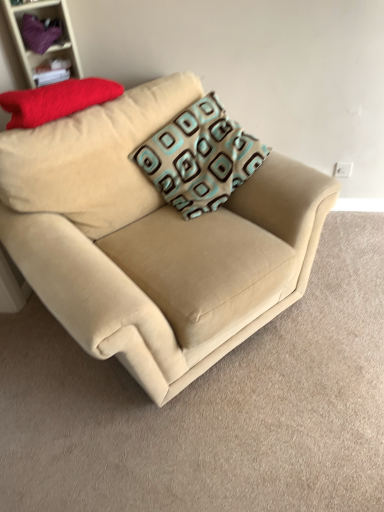
Looking at this image, measure the distance between purple fabric at upper left and camera.

A distance of 5.94 feet exists between purple fabric at upper left and camera.

Image resolution: width=384 pixels, height=512 pixels. Identify the location of beige fabric couch at center. (153, 237).

At what (x,y) coordinates should I click in order to perform the action: click on teal-patterned cushion at center, which is the first pillow from right to left. Please return your answer as a coordinate pair (x, y). The image size is (384, 512). Looking at the image, I should click on (199, 158).

Identify the location of matte red pillow at upper left, acting as the 2th pillow starting from the right. The height and width of the screenshot is (512, 384). (56, 100).

Identify the location of purple fabric at upper left. This screenshot has width=384, height=512. (40, 33).

Based on the photo, can you confirm if matte red pillow at upper left, which appears as the 1th pillow when viewed from the left, is positioned to the left of matte purple fabric at upper left?

Incorrect, matte red pillow at upper left, which appears as the 1th pillow when viewed from the left, is not on the left side of matte purple fabric at upper left.

From the picture: Which of these two, matte red pillow at upper left, acting as the 2th pillow starting from the right, or matte purple fabric at upper left, stands taller?

matte purple fabric at upper left.

Would you consider matte red pillow at upper left, which appears as the 1th pillow when viewed from the left, to be distant from matte purple fabric at upper left?

That's not correct — matte red pillow at upper left, which appears as the 1th pillow when viewed from the left, is a little close to matte purple fabric at upper left.

Could you tell me if matte red pillow at upper left, which appears as the 1th pillow when viewed from the left, is facing matte purple fabric at upper left?

No, matte red pillow at upper left, which appears as the 1th pillow when viewed from the left, does not turn towards matte purple fabric at upper left.

What's the angular difference between beige fabric couch at center and teal-patterned cushion at center, the 2th pillow viewed from the left,'s facing directions?

beige fabric couch at center and teal-patterned cushion at center, the 2th pillow viewed from the left, are facing 6.04 degrees away from each other.

Which is closer to the camera, (256,278) or (250,169)?

The point (256,278) is closer to the camera.

In the scene shown: Could you tell me if beige fabric couch at center is facing teal-patterned cushion at center, which is the first pillow from right to left?

Yes, beige fabric couch at center is aimed at teal-patterned cushion at center, which is the first pillow from right to left.

Is beige fabric couch at center wider than teal-patterned cushion at center, the 2th pillow viewed from the left?

Yes.

Would you say beige fabric couch at center is part of matte red pillow at upper left, acting as the 2th pillow starting from the right,'s contents?

No, beige fabric couch at center is located outside of matte red pillow at upper left, acting as the 2th pillow starting from the right.

What's the angular difference between matte red pillow at upper left, acting as the 2th pillow starting from the right, and beige fabric couch at center's facing directions?

They differ by 4.75 degrees in their facing directions.

Could you measure the distance between matte red pillow at upper left, acting as the 2th pillow starting from the right, and beige fabric couch at center?

matte red pillow at upper left, acting as the 2th pillow starting from the right, is 50.48 centimeters away from beige fabric couch at center.

Considering the positions of objects matte red pillow at upper left, which appears as the 1th pillow when viewed from the left, and beige fabric couch at center in the image provided, who is in front, matte red pillow at upper left, which appears as the 1th pillow when viewed from the left, or beige fabric couch at center?

Positioned in front is beige fabric couch at center.

Between teal-patterned cushion at center, the 2th pillow viewed from the left, and matte red pillow at upper left, which appears as the 1th pillow when viewed from the left, which one has larger width?

Wider between the two is teal-patterned cushion at center, the 2th pillow viewed from the left.

Is point (225, 151) behind point (111, 93)?

That is True.

Can we say teal-patterned cushion at center, which is the first pillow from right to left, lies outside matte red pillow at upper left, acting as the 2th pillow starting from the right?

Yes, teal-patterned cushion at center, which is the first pillow from right to left, is located beyond the bounds of matte red pillow at upper left, acting as the 2th pillow starting from the right.

Considering the relative positions of teal-patterned cushion at center, which is the first pillow from right to left, and matte red pillow at upper left, which appears as the 1th pillow when viewed from the left, in the image provided, is teal-patterned cushion at center, which is the first pillow from right to left, to the left of matte red pillow at upper left, which appears as the 1th pillow when viewed from the left, from the viewer's perspective?

No, teal-patterned cushion at center, which is the first pillow from right to left, is not to the left of matte red pillow at upper left, which appears as the 1th pillow when viewed from the left.

Consider the image. Between matte purple fabric at upper left and purple fabric at upper left, which one has larger width?

Wider between the two is purple fabric at upper left.

Is the depth of matte purple fabric at upper left greater than that of purple fabric at upper left?

No.

Between matte purple fabric at upper left and purple fabric at upper left, which one has larger size?

Bigger between the two is matte purple fabric at upper left.

From a real-world perspective, is matte purple fabric at upper left located beneath purple fabric at upper left?

A: Yes, from a real-world perspective, matte purple fabric at upper left is under purple fabric at upper left.

Who is more distant, matte red pillow at upper left, which appears as the 1th pillow when viewed from the left, or purple fabric at upper left?

purple fabric at upper left.

Is matte red pillow at upper left, acting as the 2th pillow starting from the right, looking in the opposite direction of purple fabric at upper left?

No.

Considering the sizes of objects matte red pillow at upper left, which appears as the 1th pillow when viewed from the left, and purple fabric at upper left in the image provided, who is thinner, matte red pillow at upper left, which appears as the 1th pillow when viewed from the left, or purple fabric at upper left?

purple fabric at upper left.

Considering the relative sizes of matte red pillow at upper left, acting as the 2th pillow starting from the right, and purple fabric at upper left in the image provided, is matte red pillow at upper left, acting as the 2th pillow starting from the right, shorter than purple fabric at upper left?

In fact, matte red pillow at upper left, acting as the 2th pillow starting from the right, may be taller than purple fabric at upper left.

From a real-world perspective, is beige fabric couch at center positioned above or below matte purple fabric at upper left?

In terms of real-world spatial position, beige fabric couch at center is below matte purple fabric at upper left.

Looking at this image, is beige fabric couch at center further to camera compared to matte purple fabric at upper left?

That is False.

Is beige fabric couch at center positioned far away from matte purple fabric at upper left?

No.

How many degrees apart are the facing directions of beige fabric couch at center and matte purple fabric at upper left?

The angle between the facing direction of beige fabric couch at center and the facing direction of matte purple fabric at upper left is 10.2 degrees.

This screenshot has width=384, height=512. In order to click on pillow that is the 1st object located below the matte purple fabric at upper left (from the image's perspective) in this screenshot , I will do `click(56, 100)`.

I want to click on studio couch on the left of teal-patterned cushion at center, the 2th pillow viewed from the left, so click(x=153, y=237).

When comparing their distances from beige fabric couch at center, does matte red pillow at upper left, which appears as the 1th pillow when viewed from the left, or teal-patterned cushion at center, the 2th pillow viewed from the left, seem closer?

teal-patterned cushion at center, the 2th pillow viewed from the left.

Estimate the real-world distances between objects in this image. Which object is closer to matte purple fabric at upper left, teal-patterned cushion at center, which is the first pillow from right to left, or matte red pillow at upper left, acting as the 2th pillow starting from the right?

Among the two, matte red pillow at upper left, acting as the 2th pillow starting from the right, is located nearer to matte purple fabric at upper left.

From the picture: Which object lies nearer to the anchor point beige fabric couch at center, purple fabric at upper left or teal-patterned cushion at center, which is the first pillow from right to left?

teal-patterned cushion at center, which is the first pillow from right to left.

From the image, which object appears to be nearer to matte purple fabric at upper left, matte red pillow at upper left, acting as the 2th pillow starting from the right, or teal-patterned cushion at center, which is the first pillow from right to left?

matte red pillow at upper left, acting as the 2th pillow starting from the right.

When comparing their distances from teal-patterned cushion at center, the 2th pillow viewed from the left, does beige fabric couch at center or purple fabric at upper left seem further?

Among the two, purple fabric at upper left is located further to teal-patterned cushion at center, the 2th pillow viewed from the left.

Looking at this image, considering their positions, is matte red pillow at upper left, acting as the 2th pillow starting from the right, positioned further to purple fabric at upper left than matte purple fabric at upper left?

matte red pillow at upper left, acting as the 2th pillow starting from the right, is positioned further to the anchor purple fabric at upper left.

Considering their positions, is matte red pillow at upper left, which appears as the 1th pillow when viewed from the left, positioned closer to purple fabric at upper left than teal-patterned cushion at center, the 2th pillow viewed from the left?

matte red pillow at upper left, which appears as the 1th pillow when viewed from the left.

From the image, which object appears to be farther from purple fabric at upper left, teal-patterned cushion at center, the 2th pillow viewed from the left, or matte purple fabric at upper left?

The object further to purple fabric at upper left is teal-patterned cushion at center, the 2th pillow viewed from the left.

Locate an element on the screen. This screenshot has height=512, width=384. shelf between purple fabric at upper left and beige fabric couch at center in the vertical direction is located at coordinates (51, 45).

You are a GUI agent. You are given a task and a screenshot of the screen. Output one action in this format:
    pyautogui.click(x=<x>, y=<y>)
    Task: Click on the studio couch situated between matte red pillow at upper left, acting as the 2th pillow starting from the right, and teal-patterned cushion at center, which is the first pillow from right to left, from left to right
    The height and width of the screenshot is (512, 384).
    Given the screenshot: What is the action you would take?
    pyautogui.click(x=153, y=237)

Locate an element on the screen. shelf between purple fabric at upper left and matte red pillow at upper left, acting as the 2th pillow starting from the right, in the up-down direction is located at coordinates (51, 45).

Where is `fabric located between matte purple fabric at upper left and teal-patterned cushion at center, the 2th pillow viewed from the left, in the left-right direction`? fabric located between matte purple fabric at upper left and teal-patterned cushion at center, the 2th pillow viewed from the left, in the left-right direction is located at coordinates (40, 33).